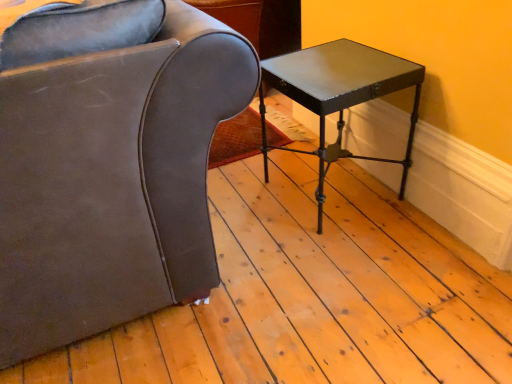
At what (x,y) coordinates should I click in order to perform the action: click on vacant area to the left of glossy black table at right. Please return your answer as a coordinate pair (x, y). Image resolution: width=512 pixels, height=384 pixels. Looking at the image, I should click on (246, 198).